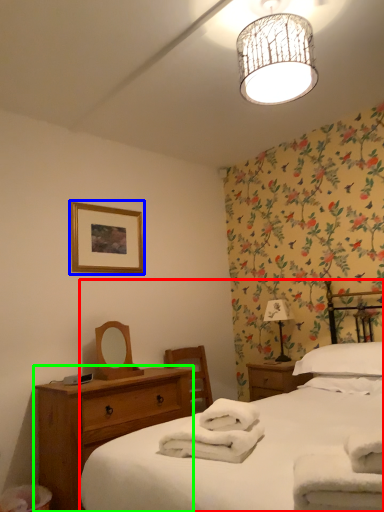
Question: Estimate the real-world distances between objects in this image. Which object is farther from bed (highlighted by a red box), picture frame (highlighted by a blue box) or nightstand (highlighted by a green box)?

Choices:
 (A) picture frame
 (B) nightstand

Answer: (A)